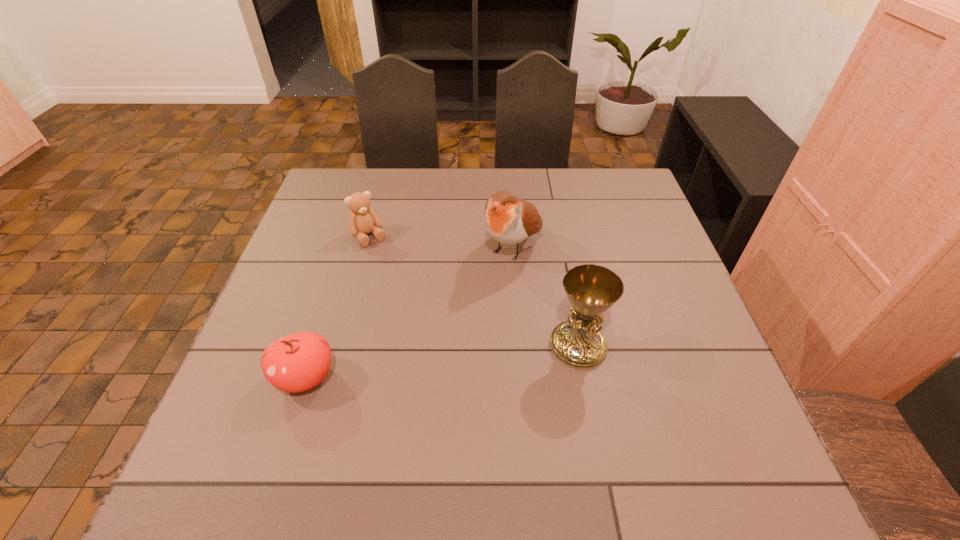
The height and width of the screenshot is (540, 960). Identify the location of vacant space in between the apple and the bird. (409, 312).

Identify the location of vacant area between the chalice and the bird. This screenshot has height=540, width=960. (545, 296).

What are the coordinates of `blank region between the teddy bear and the bird` in the screenshot? It's located at (441, 242).

Select which object is the second closest to the chalice. Please provide its 2D coordinates. Your answer should be formatted as a tuple, i.e. [(x, y)], where the tuple contains the x and y coordinates of a point satisfying the conditions above.

[(298, 362)]

The width and height of the screenshot is (960, 540). In order to click on object that can be found as the closest to the chalice in this screenshot , I will do `click(508, 219)`.

Where is `vacant space that satisfies the following two spatial constraints: 1. on the front side of the teddy bear; 2. on the right side of the bird`? The image size is (960, 540). vacant space that satisfies the following two spatial constraints: 1. on the front side of the teddy bear; 2. on the right side of the bird is located at coordinates (367, 246).

The height and width of the screenshot is (540, 960). I want to click on free region that satisfies the following two spatial constraints: 1. on the back side of the apple; 2. on the left side of the teddy bear, so click(x=351, y=237).

Identify the location of vacant space that satisfies the following two spatial constraints: 1. on the back side of the apple; 2. on the left side of the chalice. (316, 346).